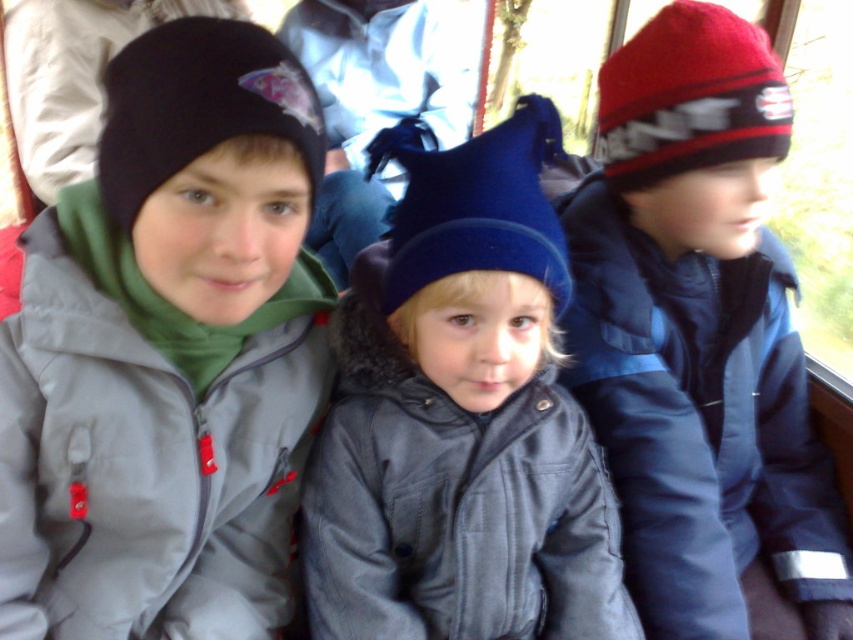
You are a photographer trying to capture a photo of the matte gray jacket at left and the velvet blue hat at center. Based on their positions in the scene, which object should you focus on first to ensure both are in sharp focus?

The matte gray jacket at left is above the velvet blue hat at center, so you should focus on the matte gray jacket at left first to ensure both are in sharp focus.

You are a photographer trying to capture a group photo of the matte gray jacket at left and the red knit hat at right. Since you want to ensure both items are clearly visible, which object should you focus on first to account for their sizes?

The matte gray jacket at left is smaller than the red knit hat at right, so you should focus on the matte gray jacket at left first to ensure its details are clear before adjusting for the larger red knit hat at right.

You are a photographer trying to capture a photo of the red knit hat at right. You have a camera with a zoom lens. The camera is currently focused on the point at coordinates (701, 340). Is the red knit hat at right in focus?

Yes, the red knit hat at right is in focus because the camera is focused on the point where it is located at (701, 340).